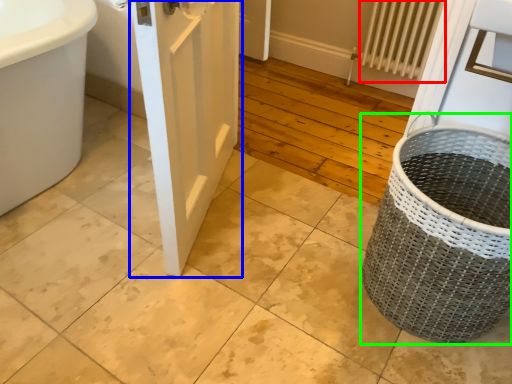
Question: Which object is positioned closest to radiator (highlighted by a red box)? Select from door (highlighted by a blue box) and basket container (highlighted by a green box).

Choices:
 (A) door
 (B) basket container

Answer: (A)